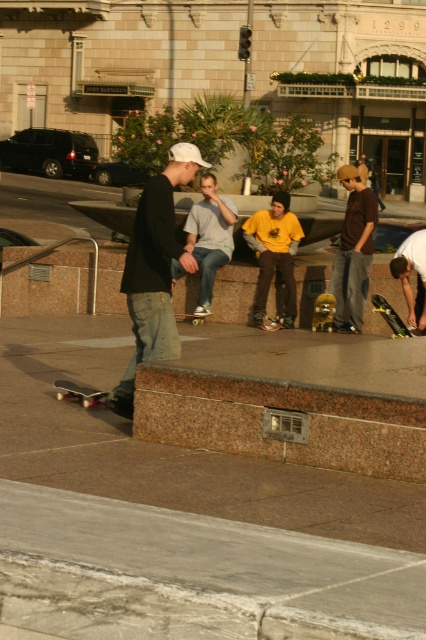
Question: Is white matte shirt at lower right to the right of wooden deck skateboard at center from the viewer's perspective?

Choices:
 (A) yes
 (B) no

Answer: (A)

Question: Among these points, which one is nearest to the camera?

Choices:
 (A) (140, 308)
 (B) (420, 300)
 (C) (288, 193)

Answer: (A)

Question: Does matte brown shirt at center appear on the left side of dark gray matte skateboard at lower left?

Choices:
 (A) no
 (B) yes

Answer: (A)

Question: Estimate the real-world distances between objects in this image. Which object is farther from the yellow matte skateboard at lower right?

Choices:
 (A) wooden deck skateboard at center
 (B) matte black skateboard at center
 (C) dark gray matte skateboard at lower left
 (D) matte brown shirt at center

Answer: (C)

Question: Which point is closer to the camera?

Choices:
 (A) white matte shirt at lower right
 (B) matte black skateboard at center
 (C) dark gray matte skateboard at lower left
 (D) yellow matte skateboard at lower right

Answer: (B)

Question: Is matte black skateboard at center behind matte brown shirt at center?

Choices:
 (A) no
 (B) yes

Answer: (A)